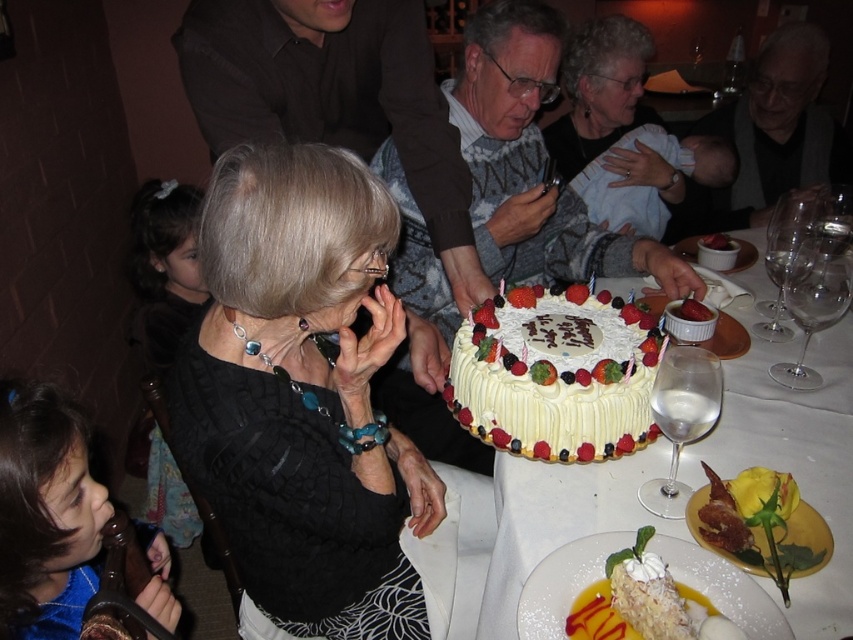
You are at a family gathering and see the matte black sweater at center and the powdered sugar cake at center. Which object is positioned to the right of the other?

The matte black sweater at center is to the right of the powdered sugar cake at center.